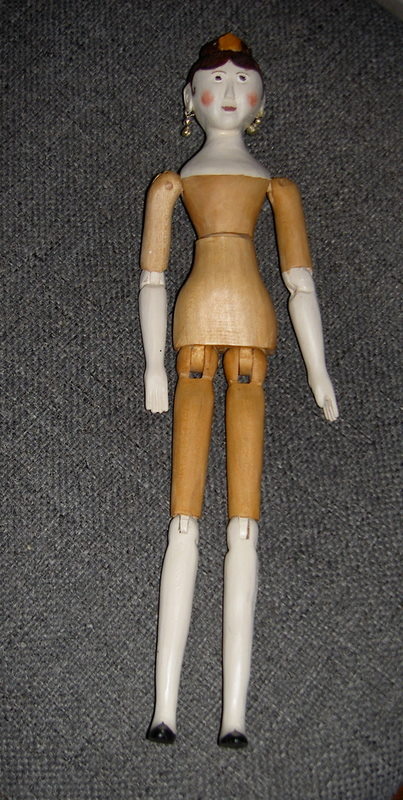
Locate an element on the screen. doll is located at coordinates (226, 214).